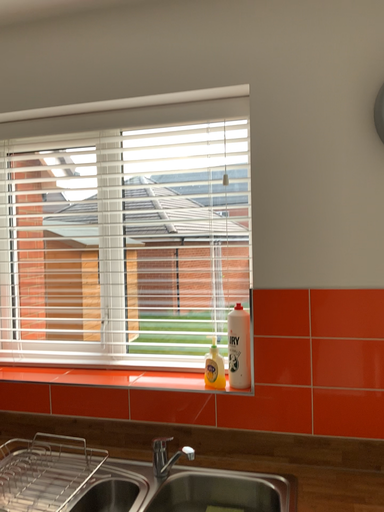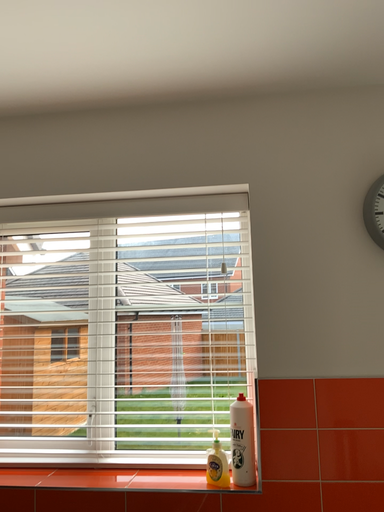
Question: How did the camera likely rotate when shooting the video?

Choices:
 (A) rotated right
 (B) rotated left

Answer: (A)